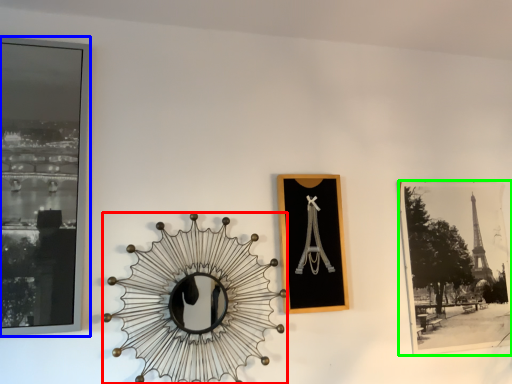
Question: Which object is positioned closest to design (highlighted by a red box)? Select from picture frame (highlighted by a blue box) and picture frame (highlighted by a green box).

Choices:
 (A) picture frame
 (B) picture frame

Answer: (A)